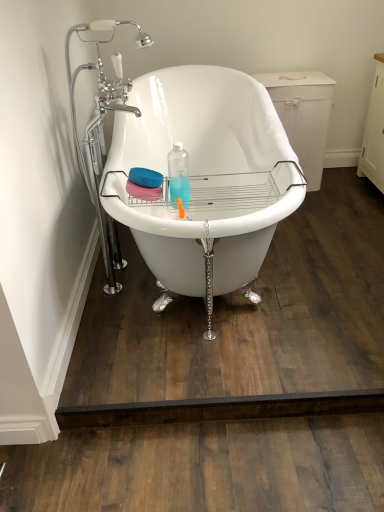
Identify the location of vacant area that lies in front of chrome/metallic faucet at upper left. This screenshot has height=512, width=384. (148, 318).